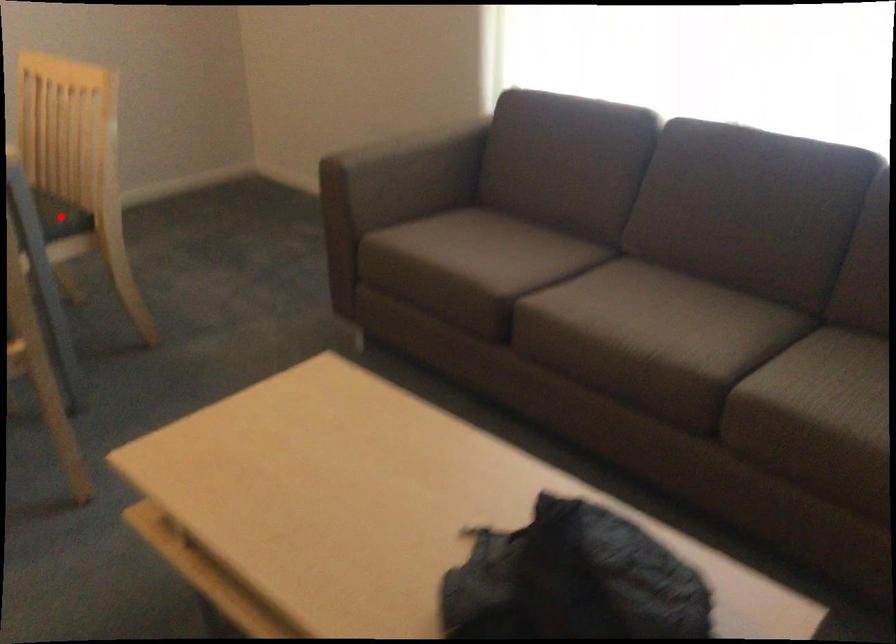
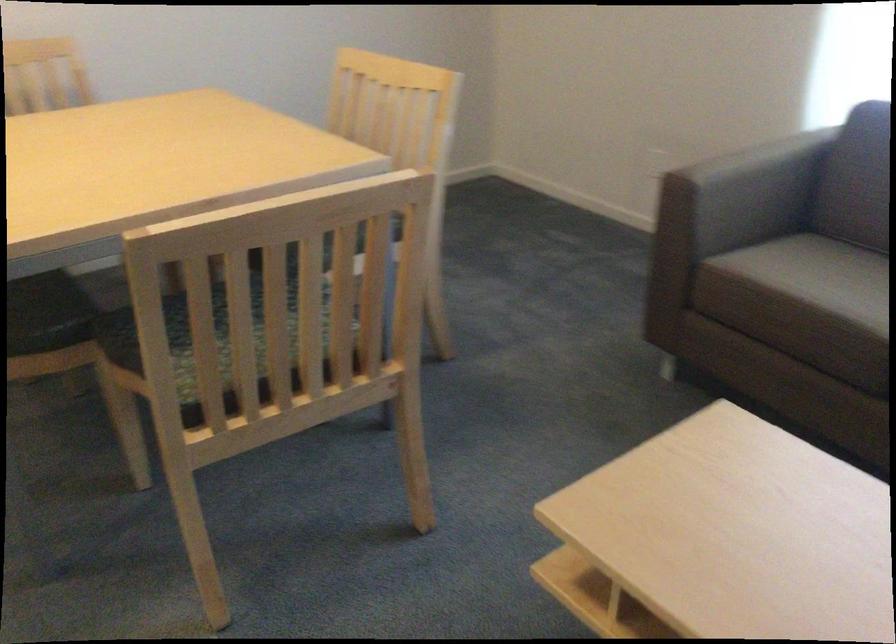
Question: I am providing you with two images of the same scene from different viewpoints. A red point is marked on the first image. Can you still see the location of the red point in image 2?

Choices:
 (A) Yes
 (B) No

Answer: (B)